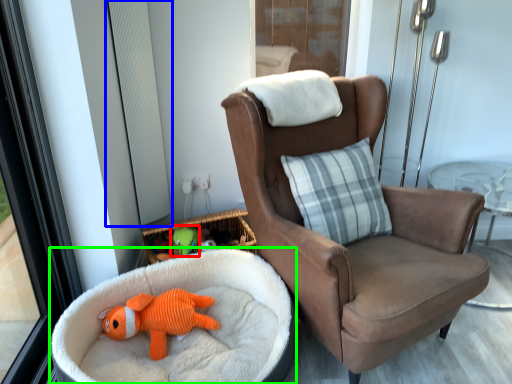
Question: Which is farther away from toy (highlighted by a red box)? window screen (highlighted by a blue box) or dog bed (highlighted by a green box)?

Choices:
 (A) window screen
 (B) dog bed

Answer: (A)